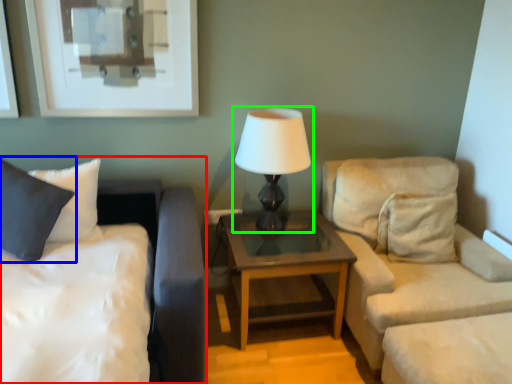
Question: Based on their relative distances, which object is nearer to bed (highlighted by a red box)? Choose from pillow (highlighted by a blue box) and lamp (highlighted by a green box).

Choices:
 (A) pillow
 (B) lamp

Answer: (A)